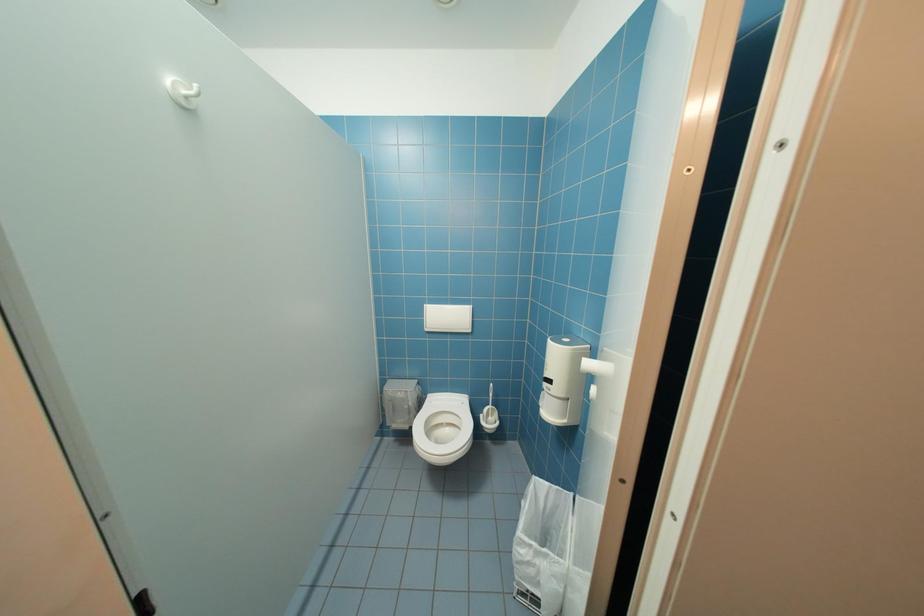
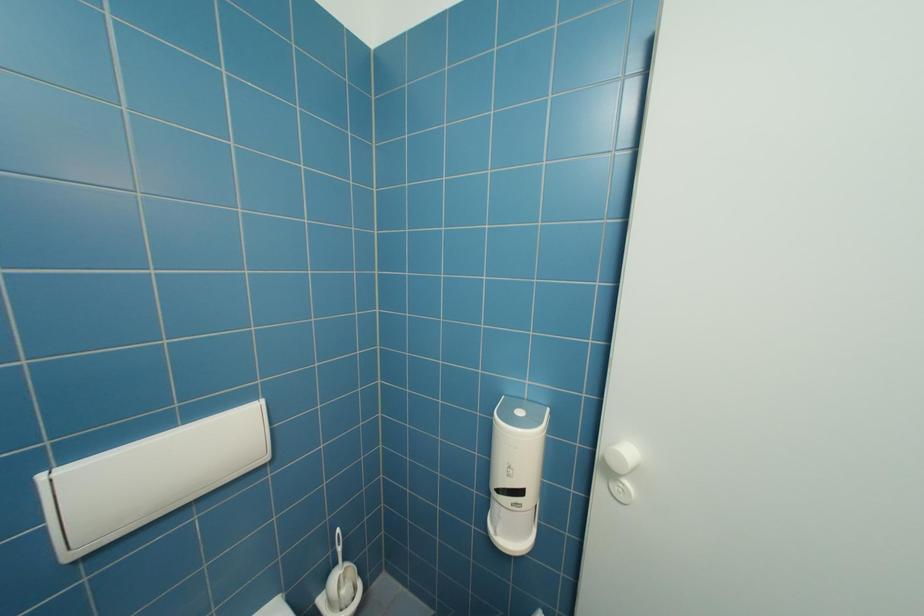
Question: The images are taken continuously from a first-person perspective. In which direction is your viewpoint rotating?

Choices:
 (A) Left
 (B) Right
 (C) Up
 (D) Down

Answer: (B)